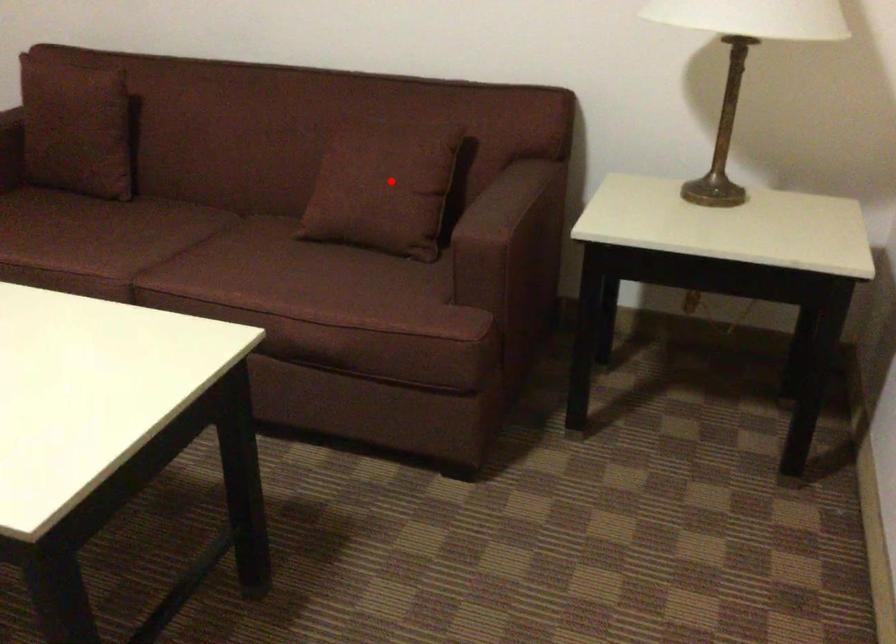
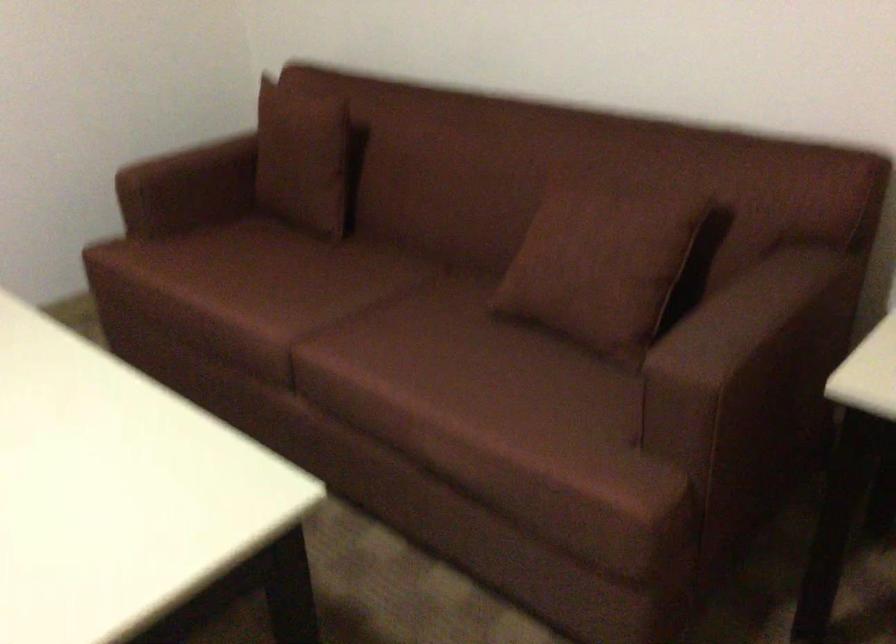
Locate, in the second image, the point that corresponds to the highlighted location in the first image.

(600, 263)